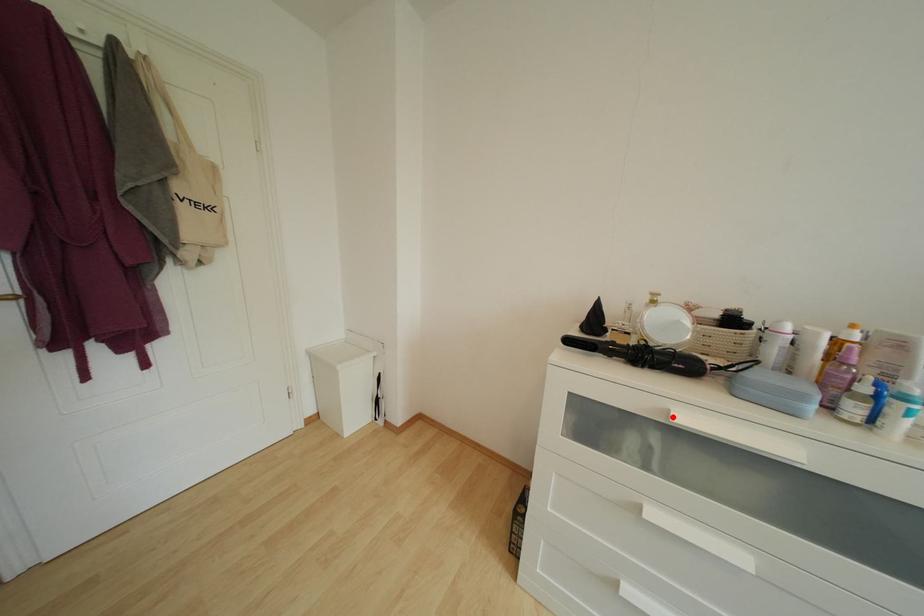
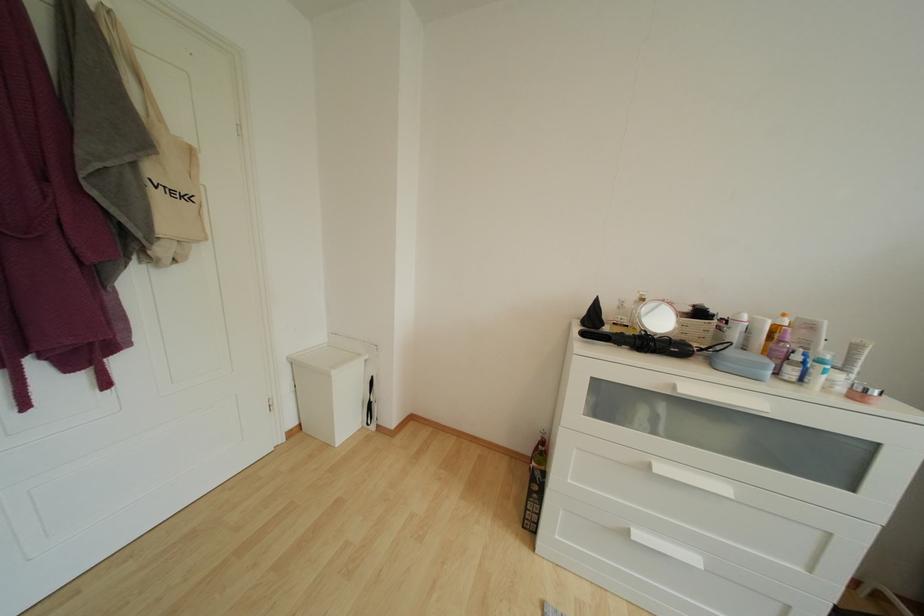
The point at the highlighted location is marked in the first image. Where is the corresponding point in the second image?

(678, 391)